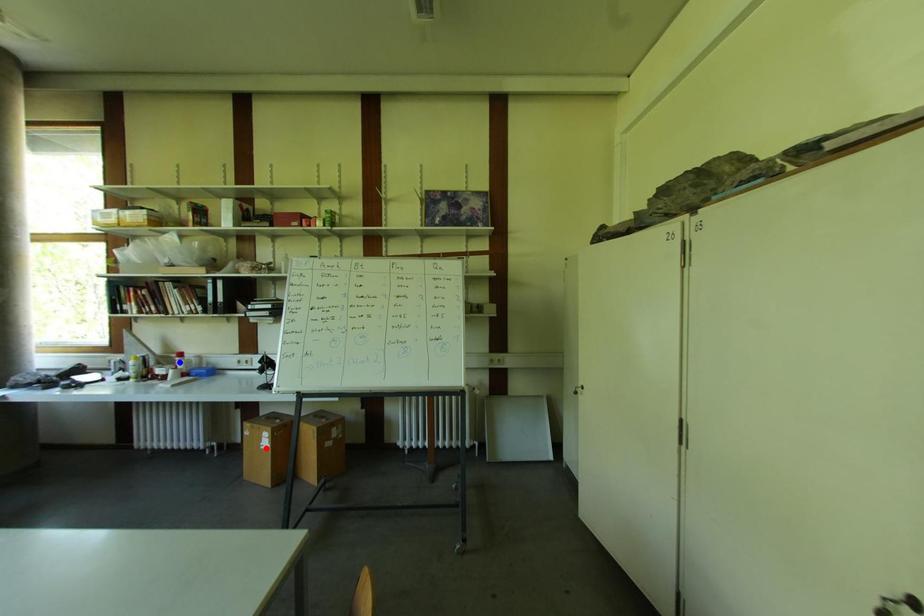
Question: Which of the two points in the image is closer to the camera?

Choices:
 (A) Blue point is closer.
 (B) Red point is closer.

Answer: (B)